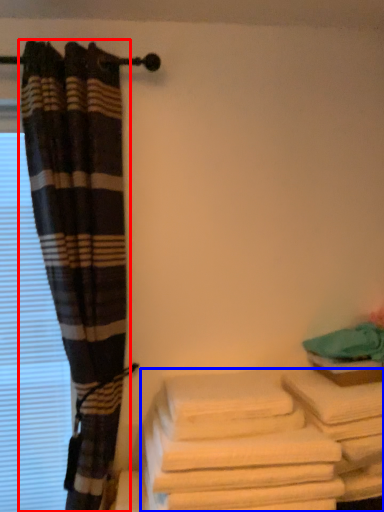
Question: Which object appears closest to the camera in this image, curtain (highlighted by a red box) or towel (highlighted by a blue box)?

Choices:
 (A) curtain
 (B) towel

Answer: (B)